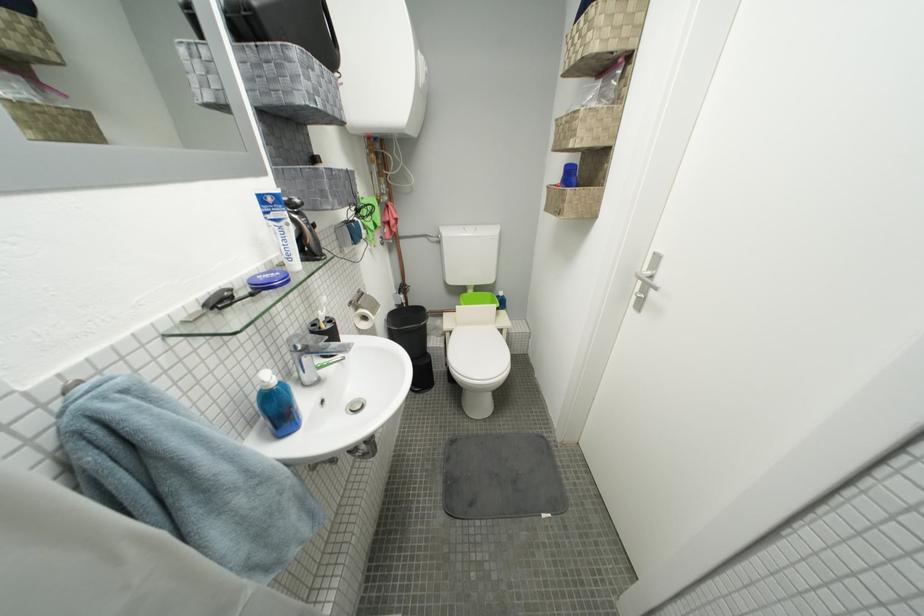
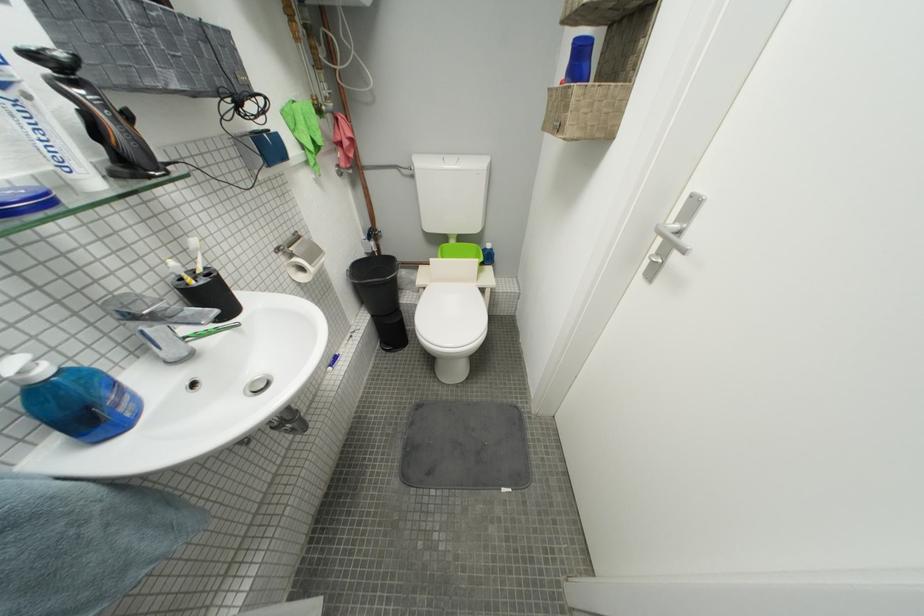
Locate, in the second image, the point that corresponds to the point at 456,329 in the first image.

(429, 284)